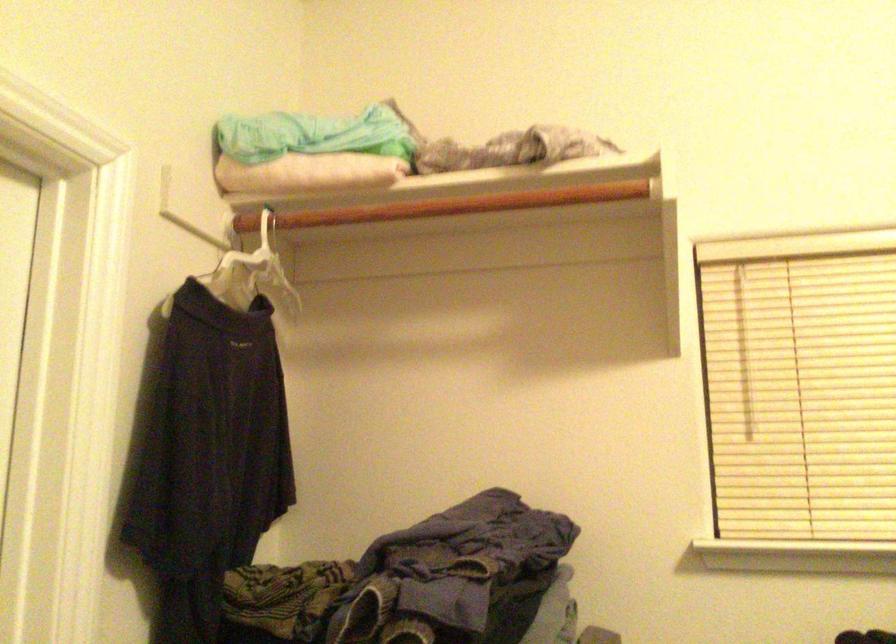
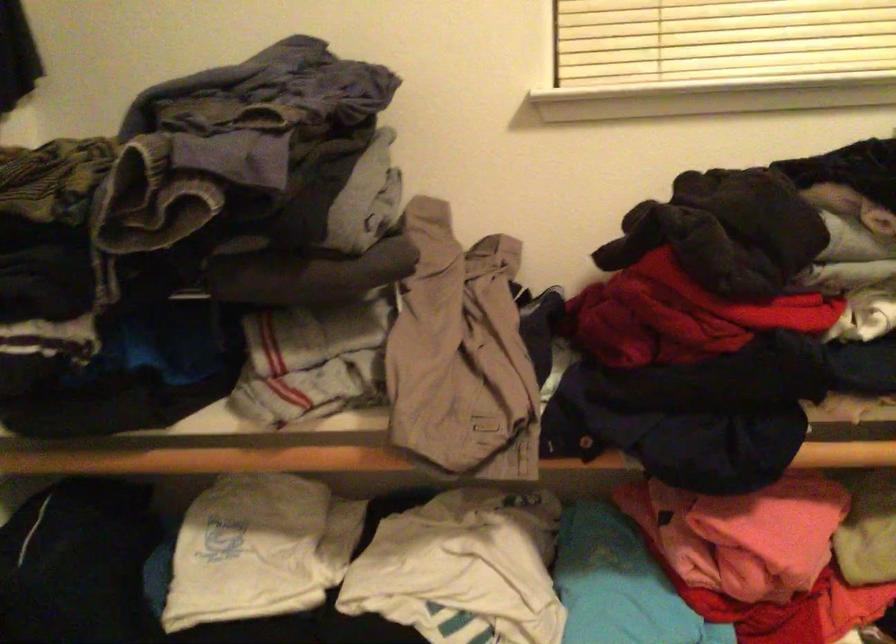
Question: Which direction would the cameraman need to move to produce the second image? Reply with the corresponding letter.

Choices:
 (A) Left
 (B) Right
 (C) Forward
 (D) Backward

Answer: (C)